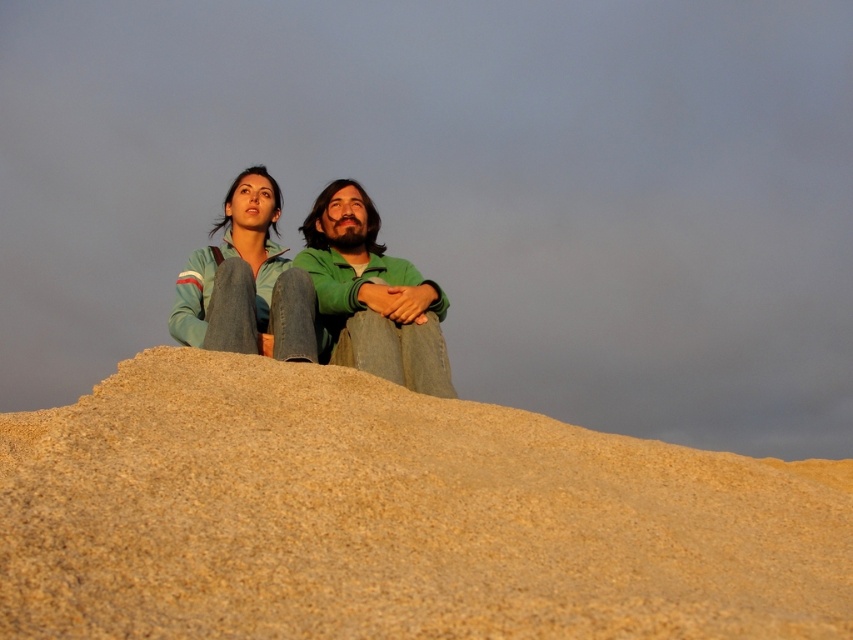
Question: Which object appears closest to the camera in this image?

Choices:
 (A) fine sand mound at center
 (B) denim jacket at upper center
 (C) green matte jacket at center

Answer: (A)

Question: Which point appears farthest from the camera in this image?

Choices:
 (A) (424, 592)
 (B) (350, 252)

Answer: (B)

Question: Can you confirm if green matte jacket at center is smaller than denim jacket at upper center?

Choices:
 (A) yes
 (B) no

Answer: (A)

Question: Does fine sand mound at center have a larger size compared to green matte jacket at center?

Choices:
 (A) yes
 (B) no

Answer: (A)

Question: Which is farther from the fine sand mound at center?

Choices:
 (A) denim jacket at upper center
 (B) green matte jacket at center

Answer: (A)

Question: Where is fine sand mound at center located in relation to denim jacket at upper center in the image?

Choices:
 (A) below
 (B) above

Answer: (A)